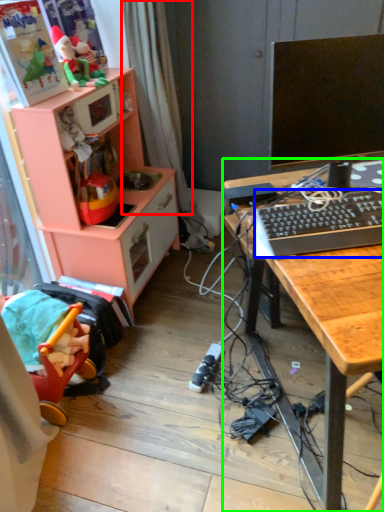
Question: Estimate the real-world distances between objects in this image. Which object is farther from curtain (highlighted by a red box), computer keyboard (highlighted by a blue box) or desk (highlighted by a green box)?

Choices:
 (A) computer keyboard
 (B) desk

Answer: (B)